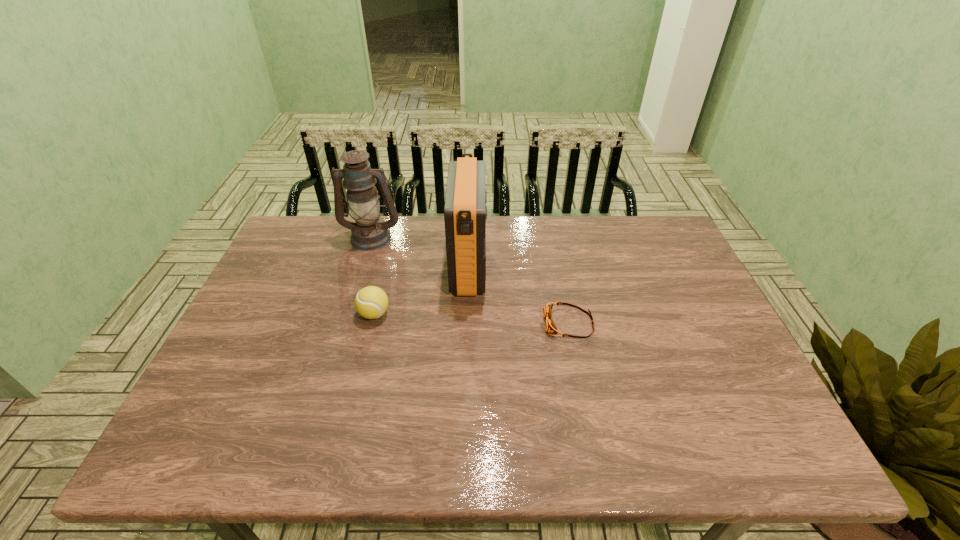
The height and width of the screenshot is (540, 960). Find the location of `oil lamp`. oil lamp is located at coordinates (369, 232).

Identify the location of the second object from right to left. The height and width of the screenshot is (540, 960). (465, 211).

Find the location of `tennis ball`. tennis ball is located at coordinates tap(371, 302).

Identify the location of goggles. (550, 327).

The image size is (960, 540). I want to click on the shortest object, so click(x=550, y=327).

What are the coordinates of `free space located on the front of the oil lamp` in the screenshot? It's located at [359, 278].

Locate an element on the screen. Image resolution: width=960 pixels, height=540 pixels. free space located 0.080m on the front-facing side of the second object from right to left is located at coordinates (513, 268).

This screenshot has height=540, width=960. In order to click on vacant space situated 0.160m on the back of the third tallest object in this screenshot , I will do `click(386, 265)`.

The width and height of the screenshot is (960, 540). I want to click on blank space located 0.260m with the lenses facing forward on the rightmost object, so click(446, 324).

Locate an element on the screen. The height and width of the screenshot is (540, 960). free space located with the lenses facing forward on the rightmost object is located at coordinates (435, 324).